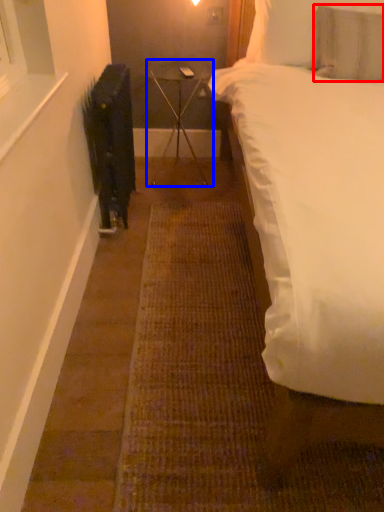
Question: Among these objects, which one is nearest to the camera, pillow (highlighted by a red box) or table (highlighted by a blue box)?

Choices:
 (A) pillow
 (B) table

Answer: (A)